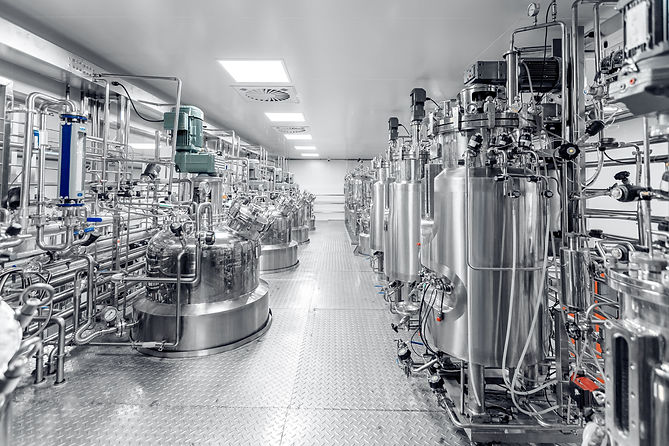
Find the location of `lines in floor`. lines in floor is located at coordinates (288, 398), (322, 407).